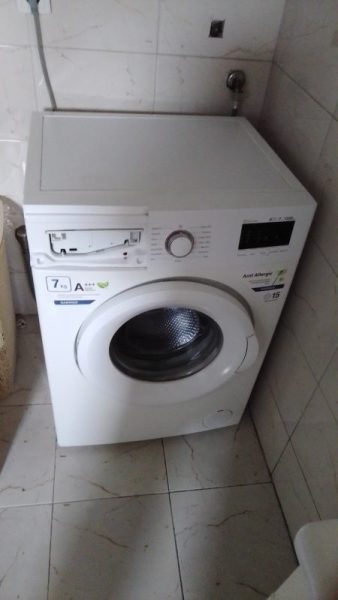
Locate an element on the screen. tile is located at coordinates (116, 560).